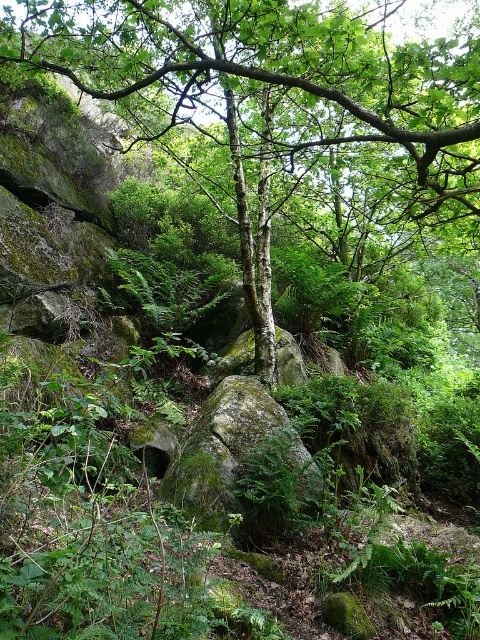
Can you confirm if green mossy tree at center is positioned to the right of green mossy rock at center?

Correct, you'll find green mossy tree at center to the right of green mossy rock at center.

Who is taller, green mossy tree at center or green mossy rock at center?

green mossy tree at center

Looking at this image, who is more distant from viewer, (136, 54) or (197, 493)?

The point (136, 54) is behind.

Image resolution: width=480 pixels, height=640 pixels. What are the coordinates of `green mossy tree at center` in the screenshot? It's located at click(x=274, y=102).